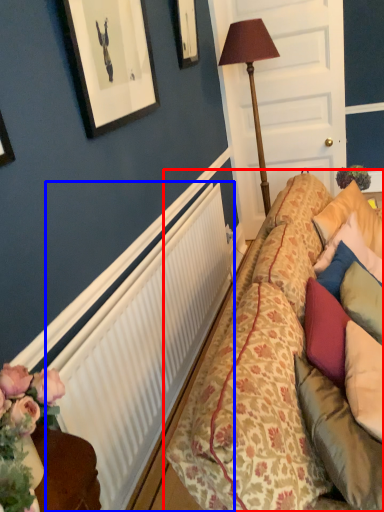
Question: Which object is further to the camera taking this photo, studio couch (highlighted by a red box) or radiator (highlighted by a blue box)?

Choices:
 (A) studio couch
 (B) radiator

Answer: (B)